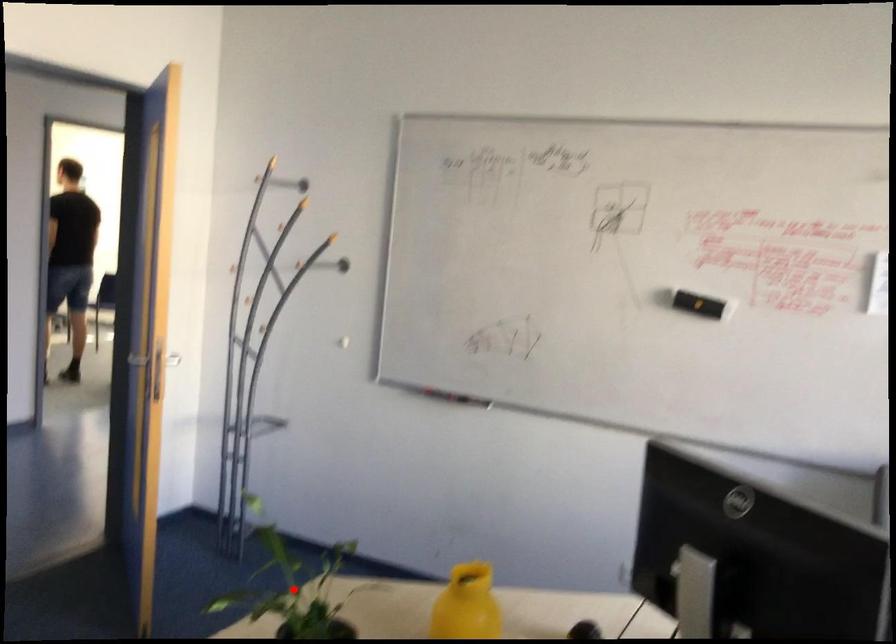
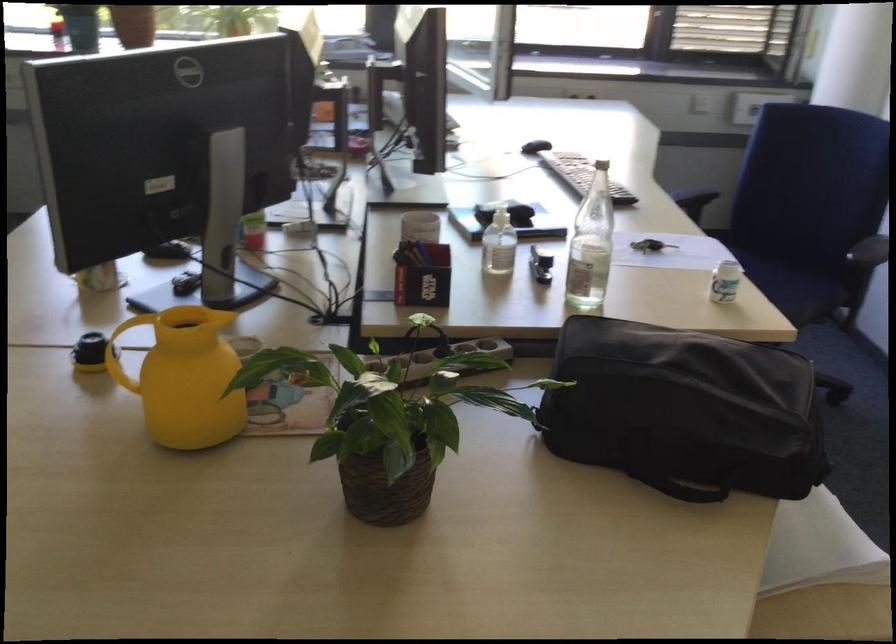
Question: I am providing you with two images of the same scene from different viewpoints. A red point is marked on the first image. At the location where the point appears in image 1, is it still visible in image 2?

Choices:
 (A) Yes
 (B) No

Answer: (B)